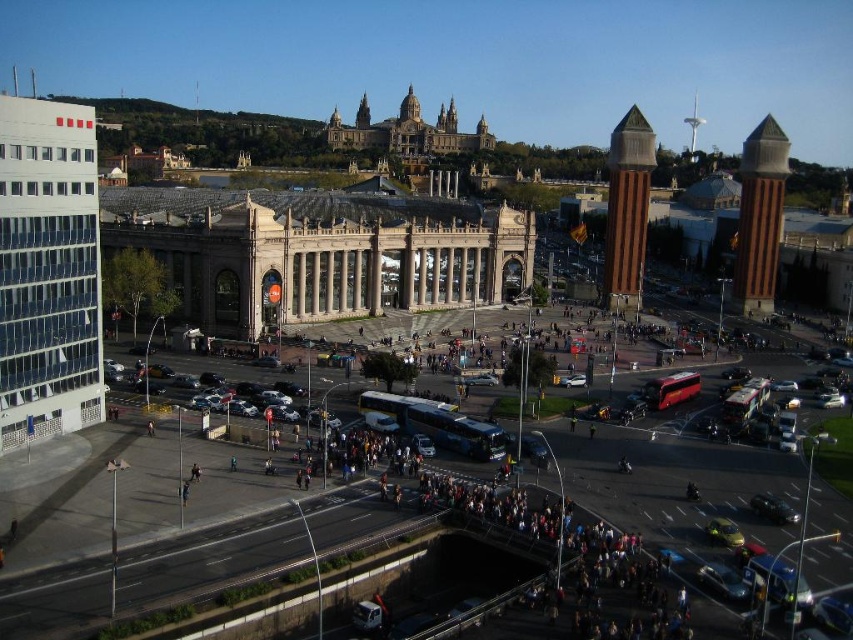
Measure the distance between brown stone tower at right and brown brick tower at center-right.

63.12 feet

Measure the distance between point (763, 198) and camera.

A distance of 124.84 meters exists between point (763, 198) and camera.

The image size is (853, 640). I want to click on brown stone tower at right, so click(x=759, y=218).